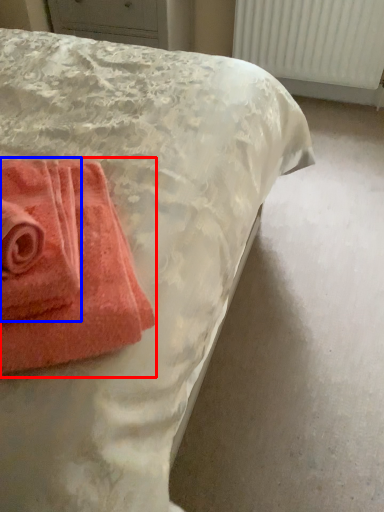
Question: Which object appears farthest to the camera in this image, towel (highlighted by a red box) or towel (highlighted by a blue box)?

Choices:
 (A) towel
 (B) towel

Answer: (B)